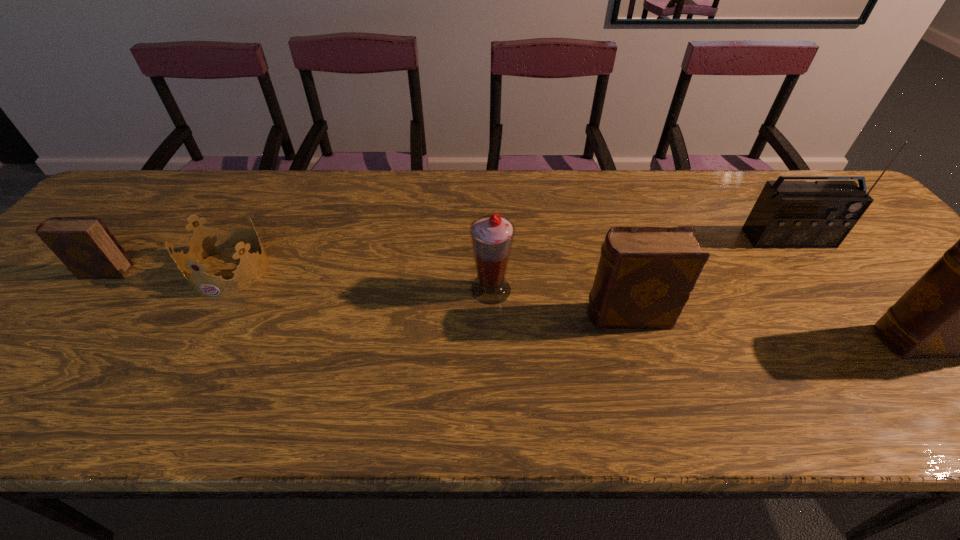
I want to click on vacant spot for a new diary to ensure equal spacing, so click(354, 293).